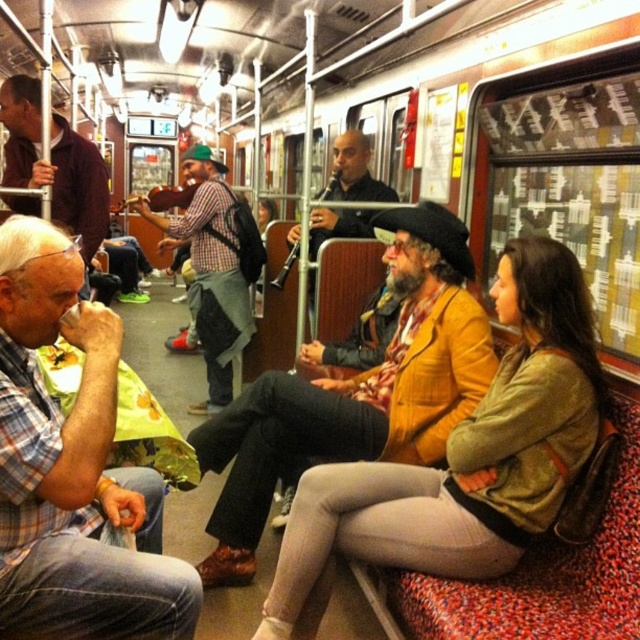
You are a subway performer carrying a 1.2 meter wide instrument. You need to find a space between the matte green jacket at center and the plaid fabric coach at left to place it. Is there enough space?

The matte green jacket at center might be wider than plaid fabric coach at left, so the space between them may not be sufficient for the 1.2 meter wide instrument. Check the actual width before placing it.

You are a photographer standing in the subway car. You want to take a photo of the matte green jacket at center and the plaid shirt at left. Which object should you focus on first if you want to capture both in the same frame without moving the camera?

The matte green jacket at center is taller than the plaid shirt at left, so you should focus on the matte green jacket at center first to ensure both are in focus since it is the larger object.